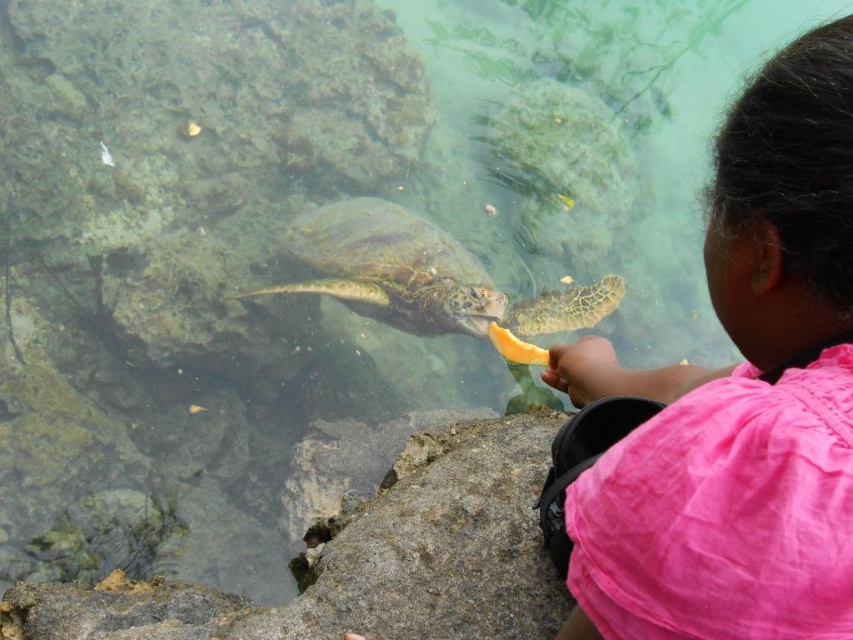
Can you confirm if pink fabric shirt at upper right is thinner than green textured shell at center?

Yes, pink fabric shirt at upper right is thinner than green textured shell at center.

Which is more to the right, pink fabric shirt at upper right or green textured shell at center?

From the viewer's perspective, pink fabric shirt at upper right appears more on the right side.

Find the location of a particular element. The width and height of the screenshot is (853, 640). pink fabric shirt at upper right is located at coordinates (740, 396).